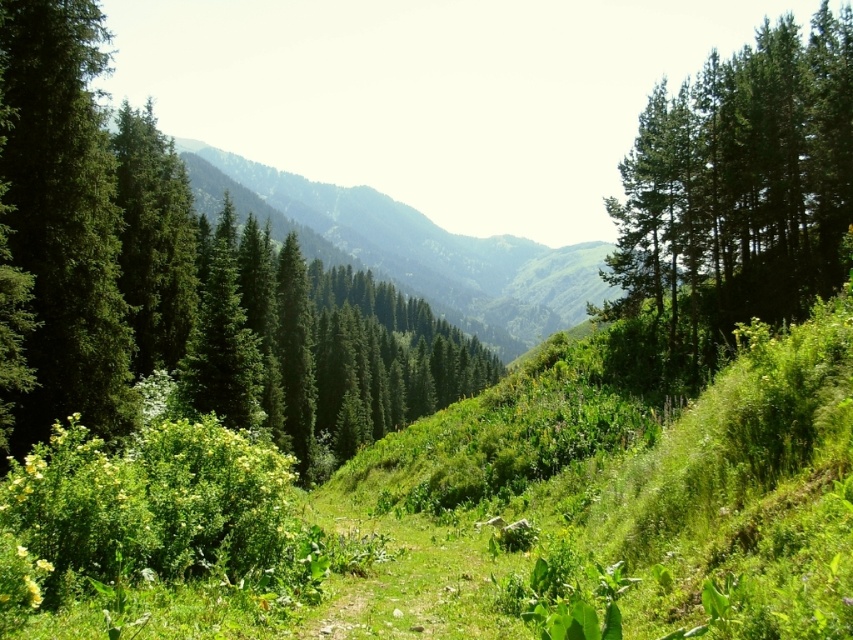
Question: Is the position of green matte tree at left less distant than that of green textured mountain at center?

Choices:
 (A) no
 (B) yes

Answer: (B)

Question: Which is nearer to the green matte tree at center?

Choices:
 (A) green textured mountain at center
 (B) green matte tree at left
 (C) green matte tree at upper right

Answer: (B)

Question: Which object is closer to the camera taking this photo?

Choices:
 (A) green textured mountain at center
 (B) green matte tree at left

Answer: (B)

Question: Can you confirm if green matte tree at center is positioned to the left of green matte tree at upper right?

Choices:
 (A) no
 (B) yes

Answer: (B)

Question: Estimate the real-world distances between objects in this image. Which object is farther from the green matte tree at left?

Choices:
 (A) green matte tree at upper right
 (B) green matte tree at center
 (C) green textured mountain at center

Answer: (C)

Question: Is green matte tree at center bigger than green matte tree at upper right?

Choices:
 (A) no
 (B) yes

Answer: (B)